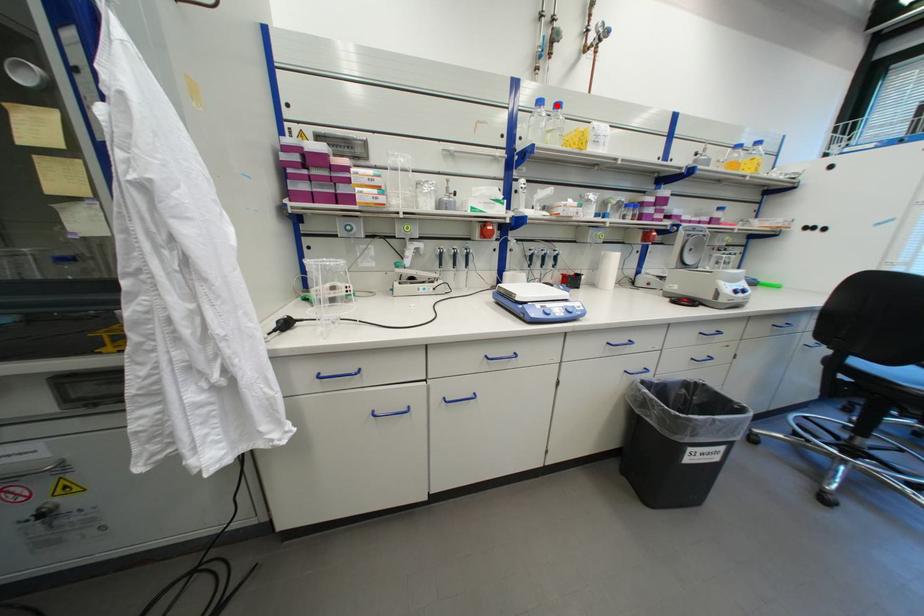
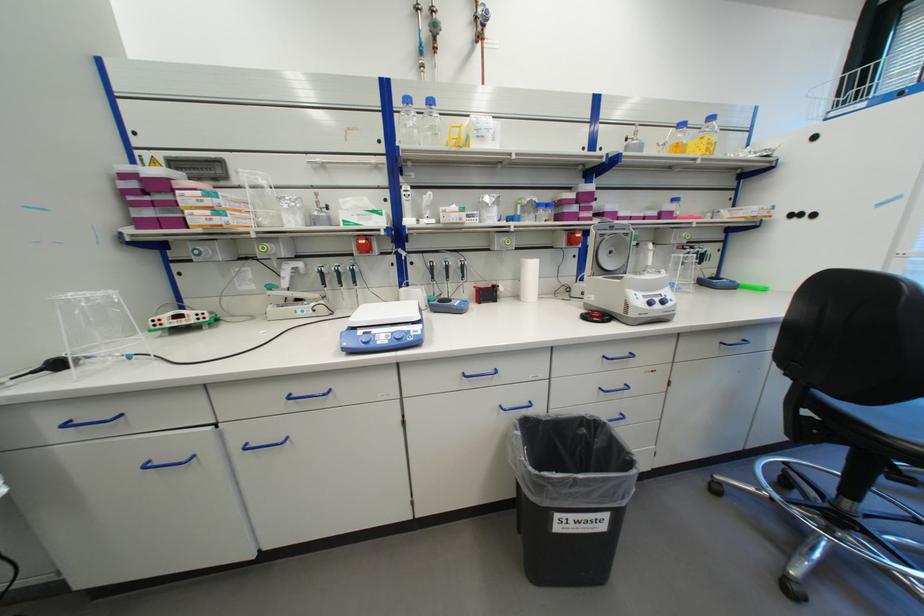
Question: I am providing you with two images of the same scene from different viewpoints. A red point is marked on the first image. Can you still see the location of the red point in image 2?

Choices:
 (A) Yes
 (B) No

Answer: (A)